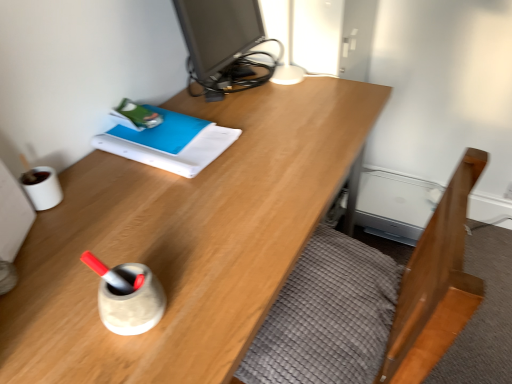
The width and height of the screenshot is (512, 384). I want to click on spots to the right of blue matte book at upper left, so click(x=271, y=144).